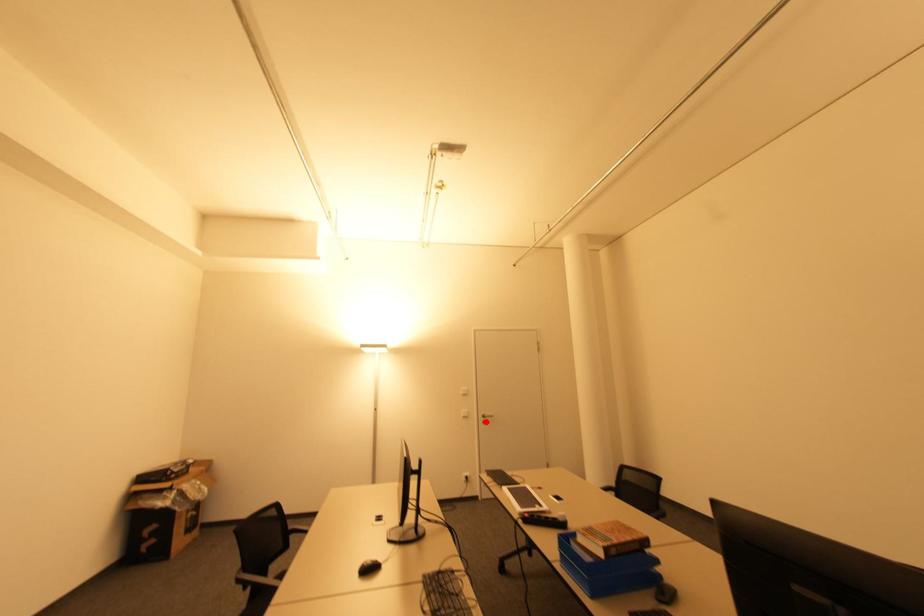
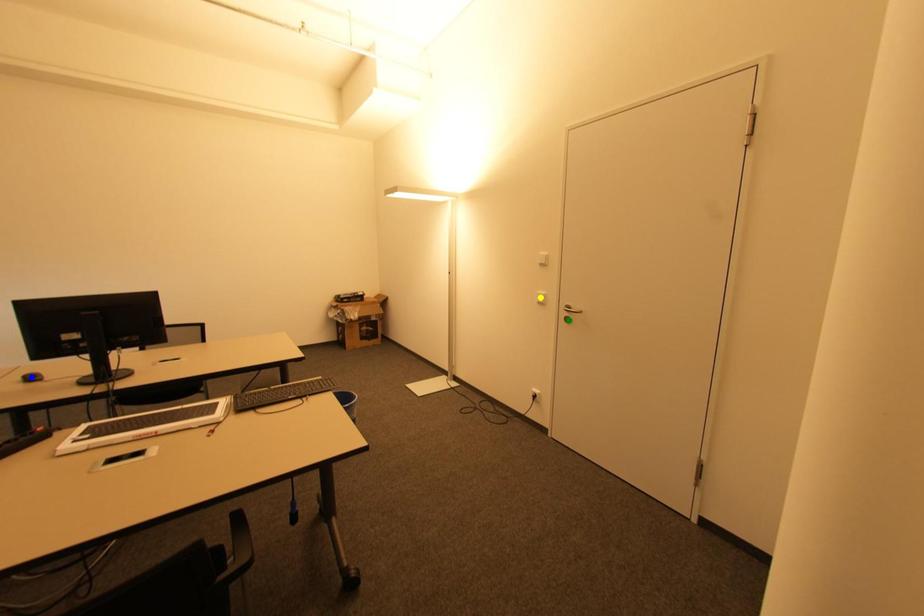
Question: I am providing you with two images of the same scene from different viewpoints. A red point is marked on the first image. You are given multiple points on the second image. Which point in image 2 is actually the same real-world point as the red point in image 1?

Choices:
 (A) yellow point
 (B) blue point
 (C) green point

Answer: (C)